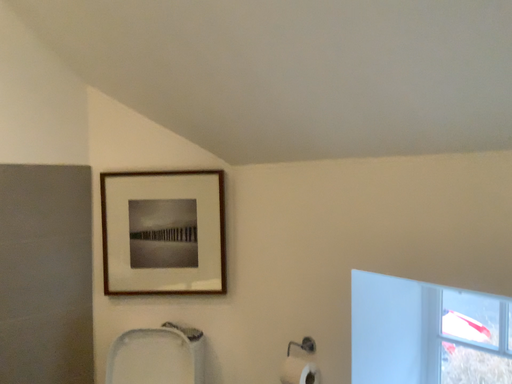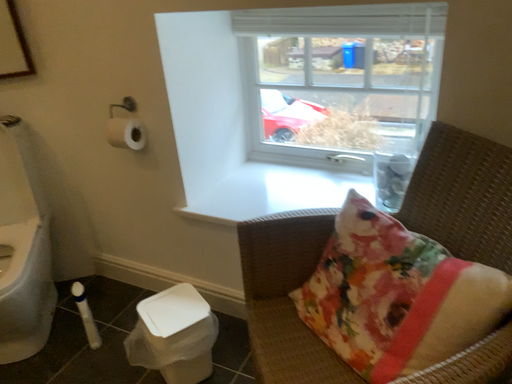
Question: Which way did the camera rotate in the video?

Choices:
 (A) rotated downward
 (B) rotated upward

Answer: (A)